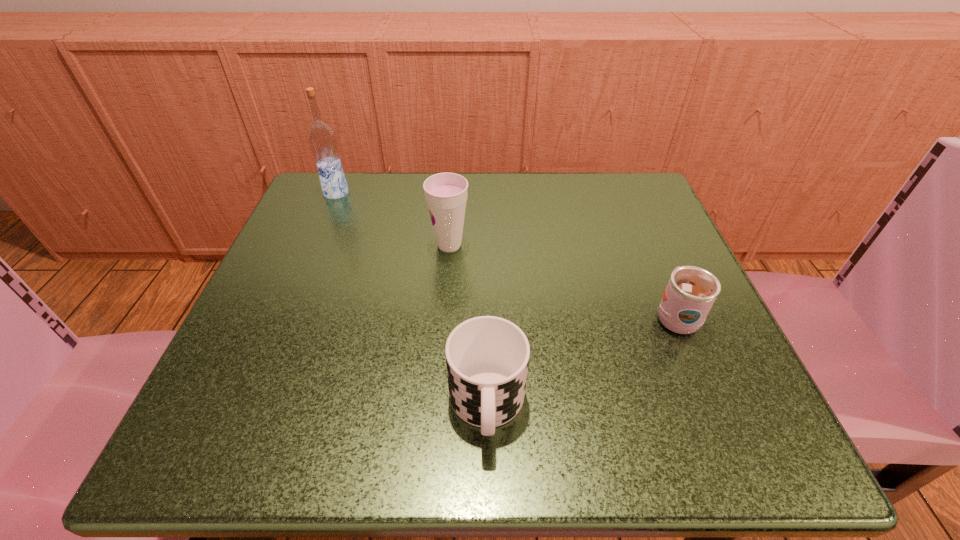
At what (x,y) coordinates should I click in order to perform the action: click on the farthest object. Please return your answer as a coordinate pair (x, y). This screenshot has width=960, height=540. Looking at the image, I should click on (322, 138).

The width and height of the screenshot is (960, 540). I want to click on the leftmost object, so click(322, 138).

Identify the location of the farthest cup. This screenshot has width=960, height=540. (446, 194).

The width and height of the screenshot is (960, 540). Identify the location of the third shortest object. (446, 194).

Where is `the third farthest object`? This screenshot has width=960, height=540. the third farthest object is located at coordinates (691, 291).

Where is `the rightmost cup`? the rightmost cup is located at coordinates (691, 291).

Identify the location of the nearest object. Image resolution: width=960 pixels, height=540 pixels. (487, 357).

Identify the location of free space located on the front of the vodka. [326, 217].

Identify the location of free spot located on the left of the second farthest object. This screenshot has width=960, height=540. (403, 245).

Where is `free location located 0.160m on the side with the handle of the second nearest cup`? The height and width of the screenshot is (540, 960). free location located 0.160m on the side with the handle of the second nearest cup is located at coordinates (640, 234).